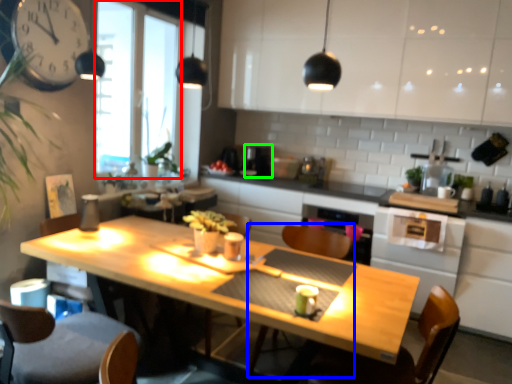
Question: Which object is the farthest from window screen (highlighted by a red box)? Choose among these: armchair (highlighted by a blue box) or coffee machine (highlighted by a green box).

Choices:
 (A) armchair
 (B) coffee machine

Answer: (A)